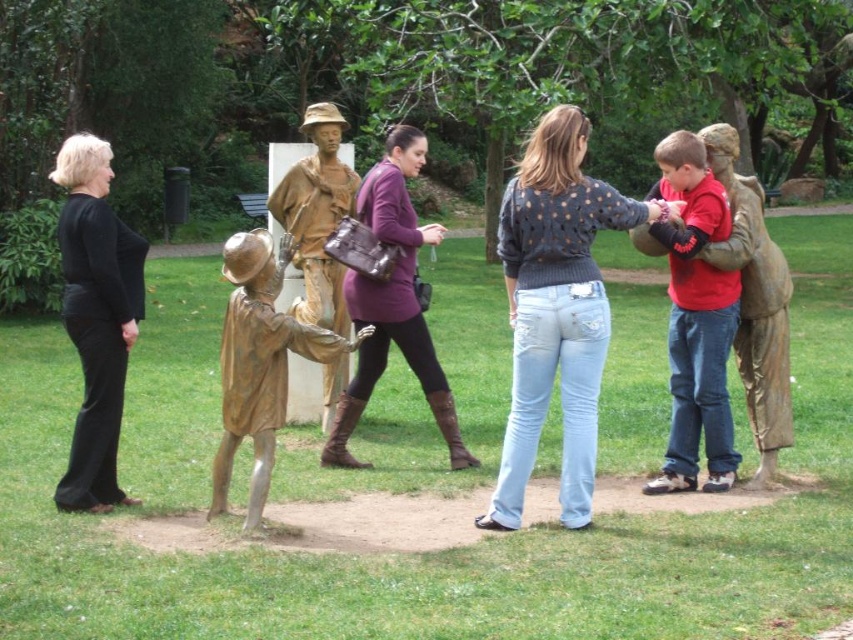
Question: Which point is closer to the camera taking this photo?

Choices:
 (A) (314, 220)
 (B) (55, 160)
 (C) (666, 186)

Answer: (C)

Question: Which of the following is the farthest from the observer?

Choices:
 (A) gold-bronze statue at center
 (B) bronze statue at center

Answer: (B)

Question: Does denim jeans at center have a greater width compared to black matte pants at left?

Choices:
 (A) no
 (B) yes

Answer: (B)

Question: Can you confirm if matte red shirt at center is positioned to the left of matte purple sweater at center?

Choices:
 (A) no
 (B) yes

Answer: (A)

Question: Is the position of matte red shirt at center more distant than that of bronze statue at center?

Choices:
 (A) yes
 (B) no

Answer: (B)

Question: Estimate the real-world distances between objects in this image. Which object is farther from the black matte pants at left?

Choices:
 (A) matte purple sweater at center
 (B) bronze statue at center
 (C) denim jeans at center
 (D) gold-bronze statue at center

Answer: (C)